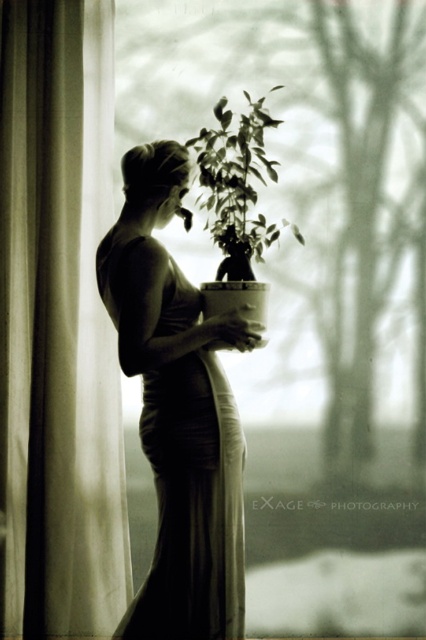
You are an interior designer assessing the lighting in this room. You notice the white sheer curtain at left and the green matte plant at center. Which object casts a longer shadow on the floor?

The white sheer curtain at left has a greater height compared to the green matte plant at center, so it casts a longer shadow on the floor.

You are a photographer setting up a shoot in this scene. You need to ensure that the matte white dress at center and the green matte plant at center are in focus simultaneously. Given that your camera has a depth of field that can cover 10 inches, will both subjects be in focus?

The matte white dress at center is 10.37 inches away from the green matte plant at center. Since the depth of field can only cover 10 inches, the distance between them exceeds the camera setting. Therefore, both subjects cannot be in focus at the same time.

You are a photographer setting up a shoot in this scene. You need to ensure that the matte white dress at center and the green matte plant at center do not overlap in the final image. Given their sizes, which object should you position further away from the camera to prevent overlap?

The matte white dress at center is wider than the green matte plant at center. To prevent overlap, position the wider matte white dress at center further away from the camera so that its larger size is reduced in the frame, while keeping the narrower green matte plant at center closer to maintain its visibility.